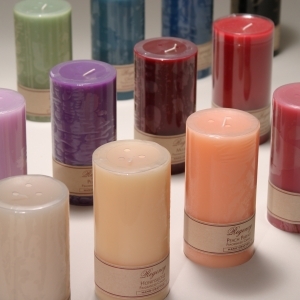
This screenshot has height=300, width=300. Find the location of `labels on candles`. labels on candles is located at coordinates (284, 205), (219, 238), (128, 282), (67, 178), (176, 147), (260, 117).